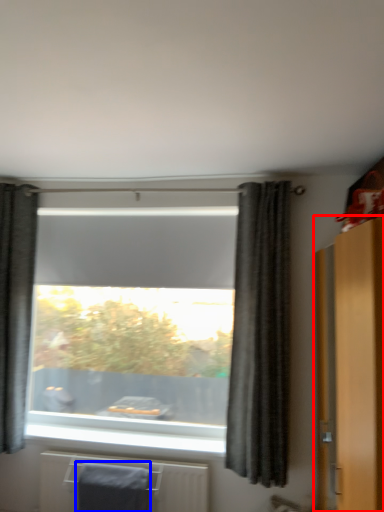
Question: Which point is closer to the camera, dresser (highlighted by a red box) or bath towel (highlighted by a blue box)?

Choices:
 (A) dresser
 (B) bath towel

Answer: (A)